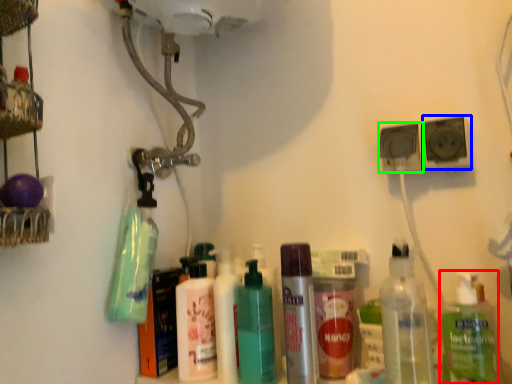
Question: Based on their relative distances, which object is nearer to bottle (highlighted by a red box)? Choose from speaker (highlighted by a blue box) and speaker (highlighted by a green box).

Choices:
 (A) speaker
 (B) speaker

Answer: (A)